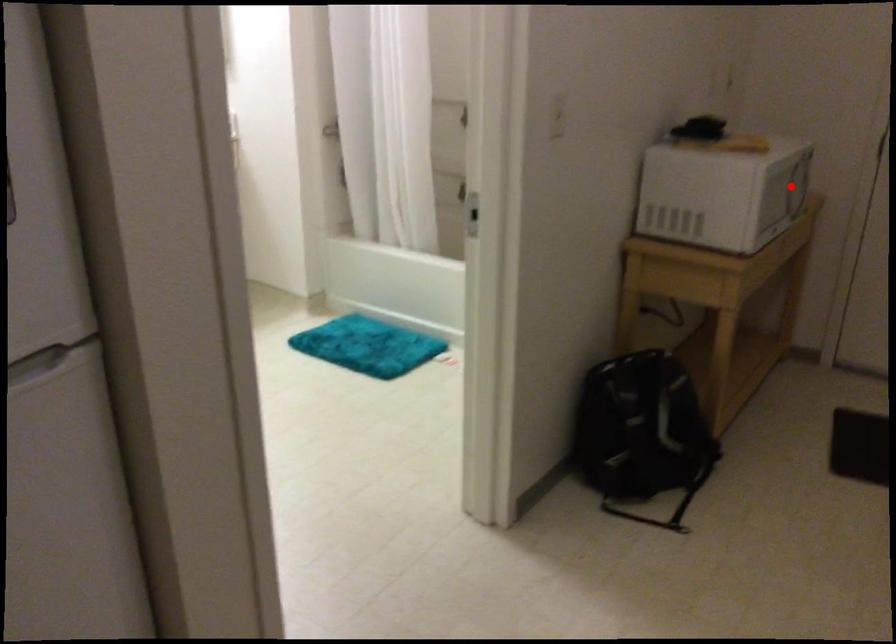
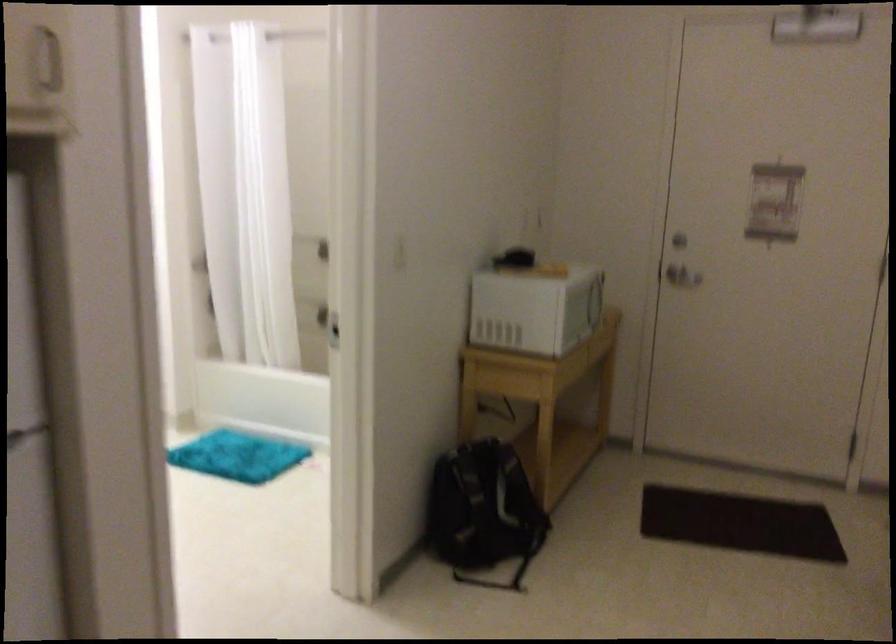
Find the pixel in the second image that matches the highlighted location in the first image.

(596, 301)